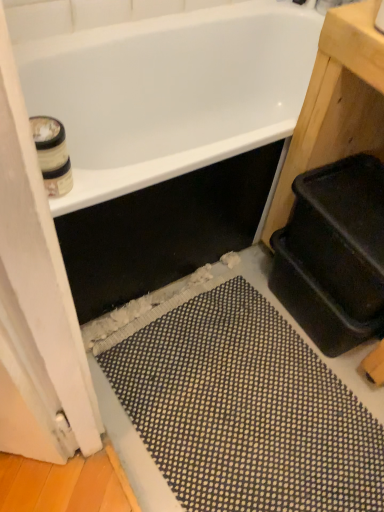
Question: From the image's perspective, is white cardboard toilet paper at upper left on white glossy bathtub at upper center?

Choices:
 (A) yes
 (B) no

Answer: (B)

Question: Can you confirm if white cardboard toilet paper at upper left is smaller than white glossy bathtub at upper center?

Choices:
 (A) no
 (B) yes

Answer: (B)

Question: Is white cardboard toilet paper at upper left to the left of white glossy bathtub at upper center from the viewer's perspective?

Choices:
 (A) no
 (B) yes

Answer: (B)

Question: Is white glossy bathtub at upper center completely or partially inside white cardboard toilet paper at upper left?

Choices:
 (A) no
 (B) yes

Answer: (A)

Question: Can you confirm if white cardboard toilet paper at upper left is positioned to the right of white glossy bathtub at upper center?

Choices:
 (A) yes
 (B) no

Answer: (B)

Question: From their relative heights in the image, would you say white glossy bathtub at upper center is taller or shorter than white cardboard toilet paper at upper left?

Choices:
 (A) tall
 (B) short

Answer: (A)

Question: Is point (190, 82) closer or farther from the camera than point (57, 189)?

Choices:
 (A) closer
 (B) farther

Answer: (B)

Question: Is white glossy bathtub at upper center wider or thinner than white cardboard toilet paper at upper left?

Choices:
 (A) wide
 (B) thin

Answer: (A)

Question: Is white glossy bathtub at upper center bigger or smaller than white cardboard toilet paper at upper left?

Choices:
 (A) big
 (B) small

Answer: (A)

Question: Considering the relative positions of white wood screen door at left and white glossy bathtub at upper center in the image provided, is white wood screen door at left to the left or to the right of white glossy bathtub at upper center?

Choices:
 (A) left
 (B) right

Answer: (A)

Question: From their relative heights in the image, would you say white wood screen door at left is taller or shorter than white glossy bathtub at upper center?

Choices:
 (A) short
 (B) tall

Answer: (B)

Question: From the image's perspective, relative to white glossy bathtub at upper center, is white wood screen door at left above or below?

Choices:
 (A) above
 (B) below

Answer: (B)

Question: Considering the positions of white wood screen door at left and white glossy bathtub at upper center in the image, is white wood screen door at left bigger or smaller than white glossy bathtub at upper center?

Choices:
 (A) big
 (B) small

Answer: (B)

Question: From the image's perspective, relative to white wood screen door at left, is white cardboard toilet paper at upper left above or below?

Choices:
 (A) above
 (B) below

Answer: (A)

Question: Is white cardboard toilet paper at upper left bigger or smaller than white wood screen door at left?

Choices:
 (A) big
 (B) small

Answer: (B)